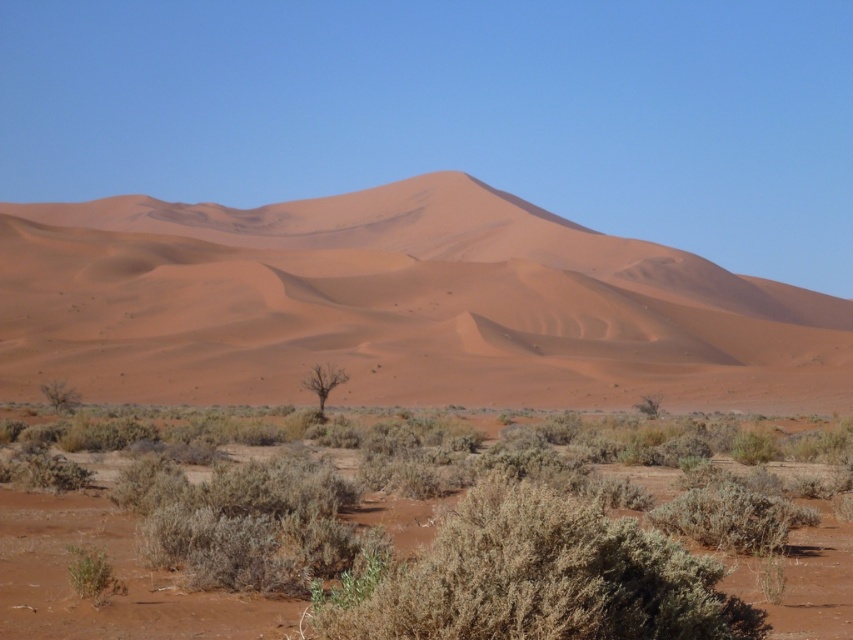
Does sandy/dry textured dune at center appear on the right side of bare/dry tree at center?

No, sandy/dry textured dune at center is not to the right of bare/dry tree at center.

Which is above, sandy/dry textured dune at center or bare/dry tree at center?

sandy/dry textured dune at center

Who is more forward, (848, 317) or (334, 385)?

Point (334, 385)

Where is `sandy/dry textured dune at center`? sandy/dry textured dune at center is located at coordinates click(x=396, y=305).

Can you confirm if bare/dry tree at center is positioned to the left of green shrub at lower left?

In fact, bare/dry tree at center is to the right of green shrub at lower left.

Measure the distance between point (332, 376) and camera.

Point (332, 376) is 55.06 meters away from camera.

The width and height of the screenshot is (853, 640). I want to click on bare/dry tree at center, so click(323, 381).

This screenshot has width=853, height=640. I want to click on bare/dry tree at center, so click(323, 381).

Which is behind, point (119, 380) or point (474, 563)?

The point (119, 380) is behind.

Is point (846, 394) farther from camera compared to point (364, 595)?

Yes, point (846, 394) is farther from viewer.

Locate an element on the screen. The image size is (853, 640). sandy/dry textured dune at center is located at coordinates (396, 305).